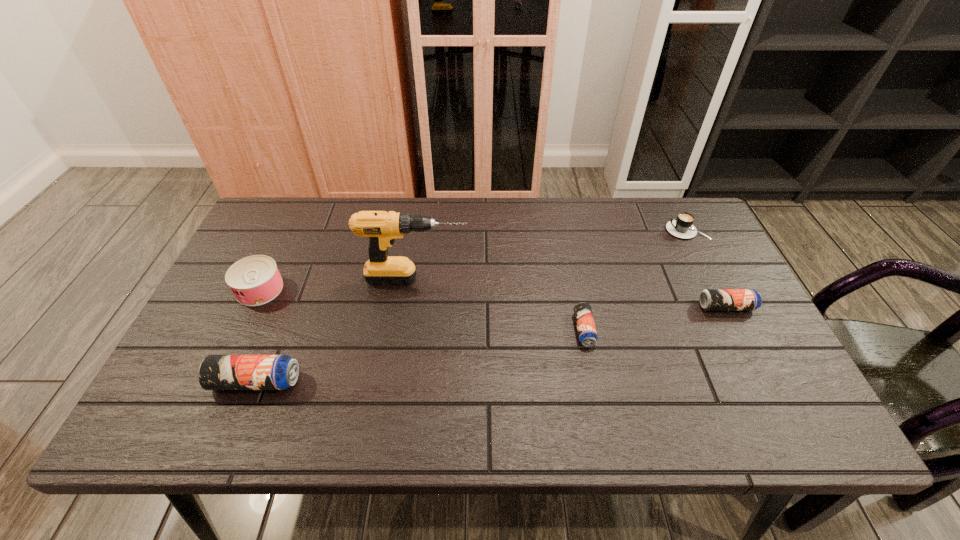
The width and height of the screenshot is (960, 540). I want to click on blank space located on the right of the second beer can from left to right, so point(645,329).

At what (x,y) coordinates should I click in order to perform the action: click on blank space located 0.180m on the back of the second shortest beer can. Please return your answer as a coordinate pair (x, y). The image size is (960, 540). Looking at the image, I should click on (699, 253).

Identify the location of free space located 0.070m on the front of the can. (242, 328).

Locate an element on the screen. free location located 0.400m with the handle on the side of the farthest object is located at coordinates (537, 230).

The height and width of the screenshot is (540, 960). In order to click on free point located 0.380m with the handle on the side of the farthest object in this screenshot , I will do `click(543, 230)`.

Locate an element on the screen. This screenshot has height=540, width=960. vacant area located 0.180m with the handle on the side of the farthest object is located at coordinates (608, 230).

The width and height of the screenshot is (960, 540). Identify the location of vacant area located 0.340m at the tip of the drill. (592, 279).

Find the location of a particular element. The image size is (960, 540). object that is at the far edge is located at coordinates (682, 226).

Locate an element on the screen. object situated at the near edge is located at coordinates (216, 372).

This screenshot has height=540, width=960. Find the location of `beer can located in the left edge section of the desktop`. beer can located in the left edge section of the desktop is located at coordinates (216, 372).